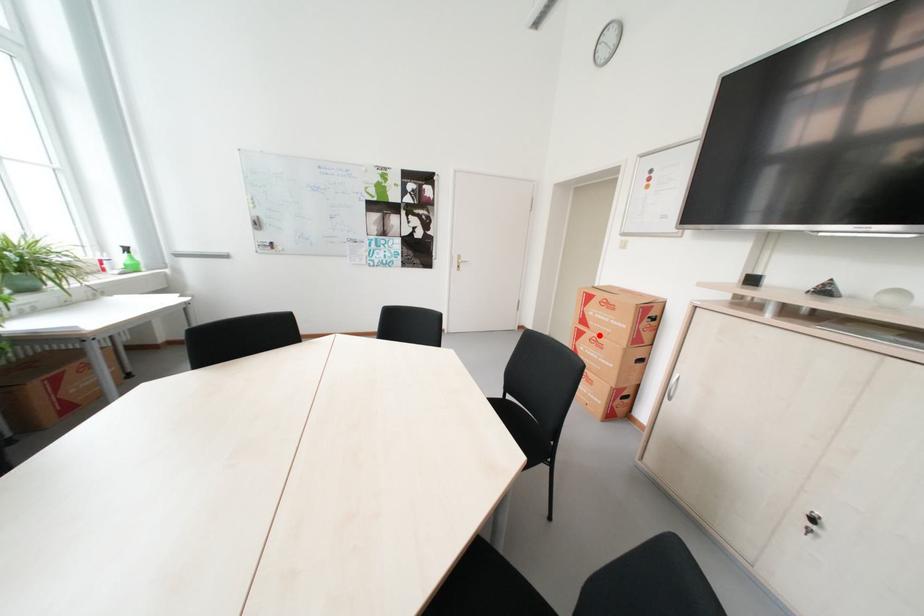
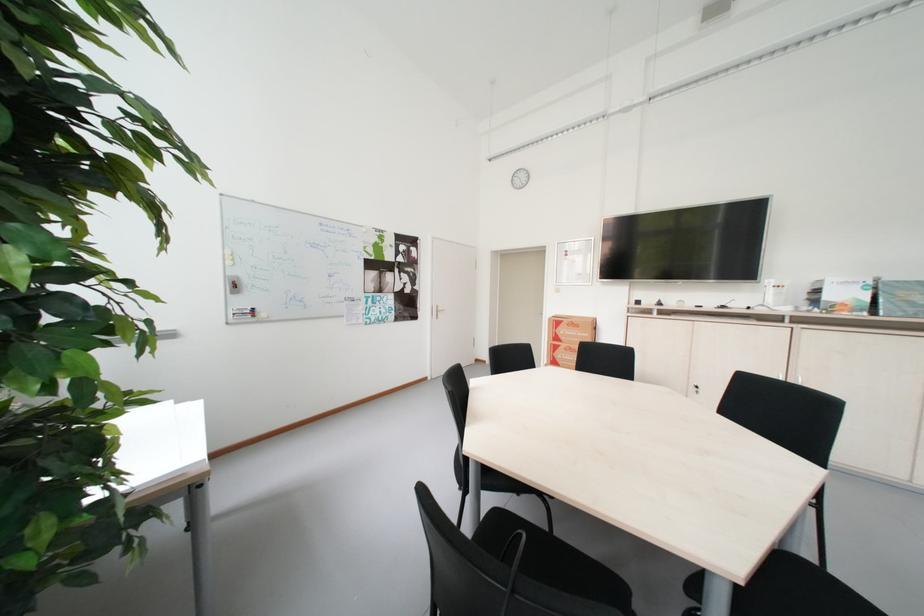
Question: I am providing you with two images of the same scene from different viewpoints. Given a red point in image1, look at the same physical point in image2. Is it:

Choices:
 (A) Closer to the viewpoint
 (B) Farther from the viewpoint

Answer: (B)